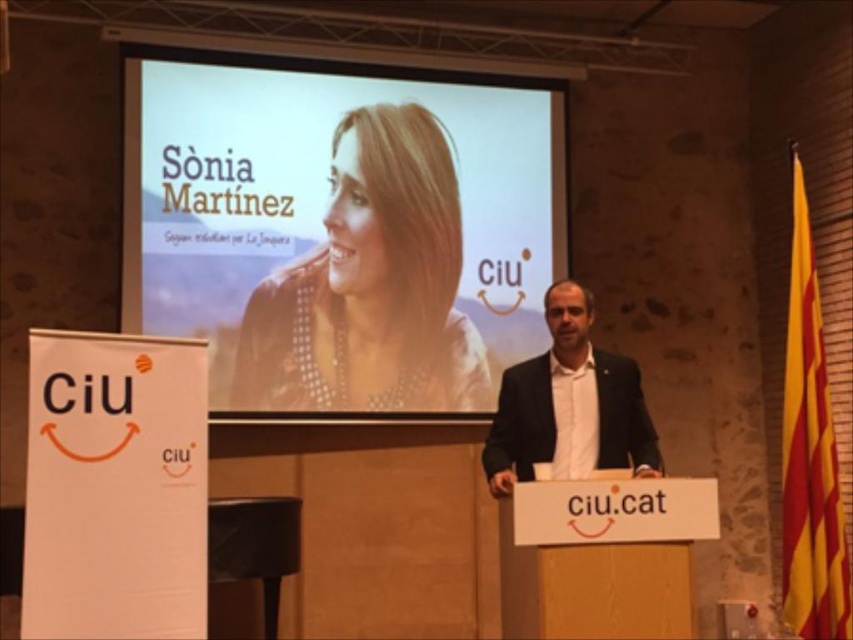
Question: Among these objects, which one is farthest from the camera?

Choices:
 (A) dark suit at center
 (B) smooth beige blouse at upper center

Answer: (B)

Question: Observing the image, what is the correct spatial positioning of smooth beige blouse at upper center in reference to dark suit at center?

Choices:
 (A) left
 (B) right

Answer: (A)

Question: Does smooth beige blouse at upper center have a larger size compared to dark suit at center?

Choices:
 (A) no
 (B) yes

Answer: (B)

Question: Does smooth beige blouse at upper center come in front of dark suit at center?

Choices:
 (A) yes
 (B) no

Answer: (B)

Question: Among these objects, which one is nearest to the camera?

Choices:
 (A) smooth beige blouse at upper center
 (B) dark suit at center

Answer: (B)